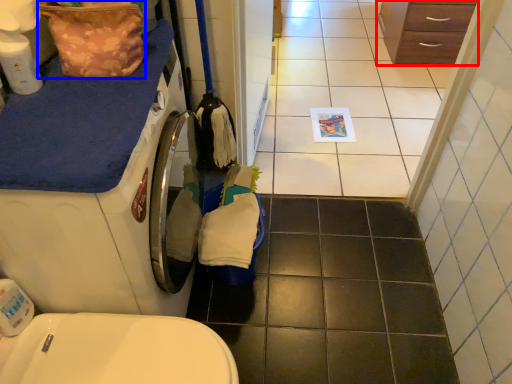
Question: Which object appears farthest to the camera in this image, chest of drawers (highlighted by a red box) or material (highlighted by a blue box)?

Choices:
 (A) chest of drawers
 (B) material

Answer: (A)